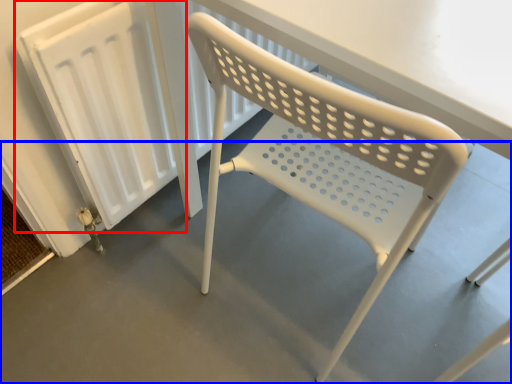
Question: Which of the following is the closest to the observer, radiator (highlighted by a red box) or concrete (highlighted by a blue box)?

Choices:
 (A) radiator
 (B) concrete

Answer: (B)